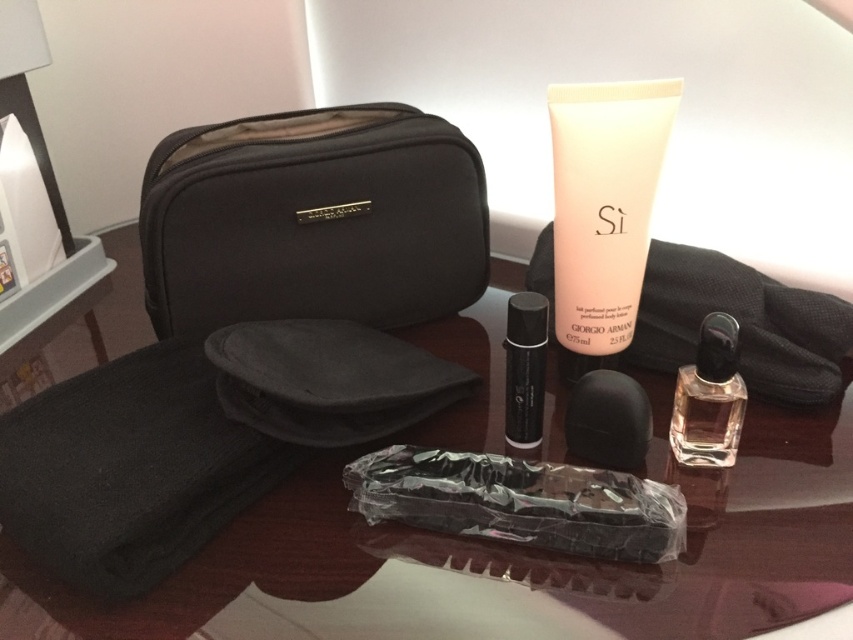
Consider the image. You are placing a small decorative item on the table. The point at coordinates (764, 540) is where you want to place it. According to the image, is this point on the transparent glass table at center?

Yes, the point at coordinates (764, 540) is on the transparent glass table at center as indicated in the Objects Description.

Based on the photo, you are trying to place a 12 inch ruler between the two objects at point (395, 150). Will the ruler fit between them?

The distance between the two objects at point (395, 150) is 35.50 inches, so the 12 inch ruler will fit between them easily.

You are organizing items on a table and want to place a new object between the transparent glass table at center and the black glass perfume at center. Can you fit a 10 cm wide object between them?

The transparent glass table at center is bigger than black glass perfume at center, but the exact distance between them isn t specified. Without knowing the space between them, it s impossible to determine if a 10 cm wide object would fit.